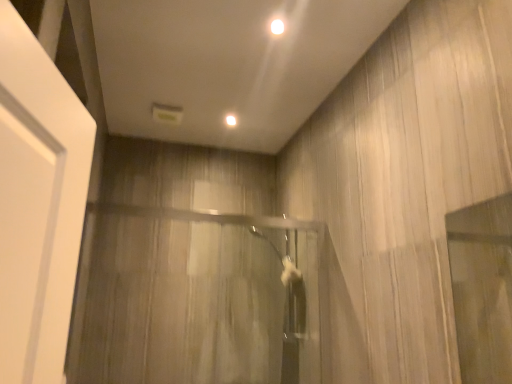
Question: From the image's perspective, would you say white glossy light at upper center, the second lighting positioned from the top, is positioned over clear glass shower door at center?

Choices:
 (A) yes
 (B) no

Answer: (A)

Question: Can you confirm if white glossy light at upper center, which appears as the first lighting when viewed from the back, is taller than clear glass shower door at center?

Choices:
 (A) no
 (B) yes

Answer: (A)

Question: From the image's perspective, is white glossy light at upper center, marked as the 1th lighting in a bottom-to-top arrangement, located beneath clear glass shower door at center?

Choices:
 (A) no
 (B) yes

Answer: (A)

Question: Is white glossy light at upper center, marked as the 2th lighting in a front-to-back arrangement, not within clear glass shower door at center?

Choices:
 (A) yes
 (B) no

Answer: (A)

Question: Is white glossy light at upper center, which appears as the first lighting when viewed from the back, at the right side of clear glass shower door at center?

Choices:
 (A) no
 (B) yes

Answer: (B)

Question: In terms of size, does white glossy light at upper center, marked as the 2th lighting in a front-to-back arrangement, appear bigger or smaller than clear glass shower door at center?

Choices:
 (A) small
 (B) big

Answer: (A)

Question: In the image, is white glossy light at upper center, which appears as the first lighting when viewed from the back, positioned in front of or behind clear glass shower door at center?

Choices:
 (A) behind
 (B) front

Answer: (A)

Question: Which is correct: white glossy light at upper center, which ranks as the first lighting in left-to-right order, is inside clear glass shower door at center, or outside of it?

Choices:
 (A) inside
 (B) outside

Answer: (B)

Question: From a real-world perspective, is white glossy light at upper center, the second lighting positioned from the top, positioned above or below clear glass shower door at center?

Choices:
 (A) above
 (B) below

Answer: (A)

Question: Relative to white glossy light at upper center, which ranks as the first lighting in left-to-right order, is white glossy light at upper center, which is the 1th lighting in front-to-back order, in front or behind?

Choices:
 (A) front
 (B) behind

Answer: (A)

Question: From a real-world perspective, is white glossy light at upper center, the 1th lighting when ordered from right to left, positioned above or below white glossy light at upper center, marked as the 1th lighting in a bottom-to-top arrangement?

Choices:
 (A) below
 (B) above

Answer: (A)

Question: Does point (276, 29) appear closer or farther from the camera than point (231, 124)?

Choices:
 (A) farther
 (B) closer

Answer: (B)

Question: Is white glossy light at upper center, placed as the 2th lighting when sorted from left to right, wider or thinner than white glossy light at upper center, which appears as the first lighting when viewed from the back?

Choices:
 (A) wide
 (B) thin

Answer: (A)

Question: Based on their positions, is clear glass shower door at center located to the left or right of white glossy light at upper center, which is the 1th lighting in front-to-back order?

Choices:
 (A) right
 (B) left

Answer: (B)

Question: Is clear glass shower door at center bigger or smaller than white glossy light at upper center, which is the 1th lighting in front-to-back order?

Choices:
 (A) big
 (B) small

Answer: (A)